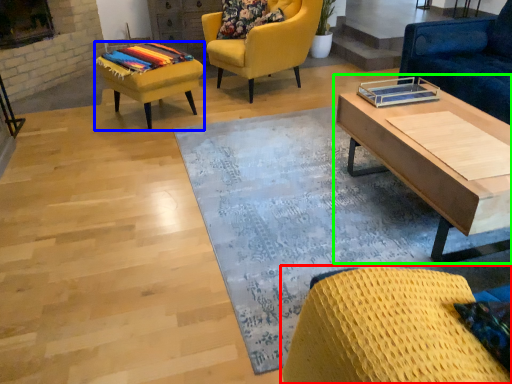
Question: Which object is positioned farthest from chair (highlighted by a red box)? Select from stool (highlighted by a blue box) and coffee table (highlighted by a green box).

Choices:
 (A) stool
 (B) coffee table

Answer: (A)